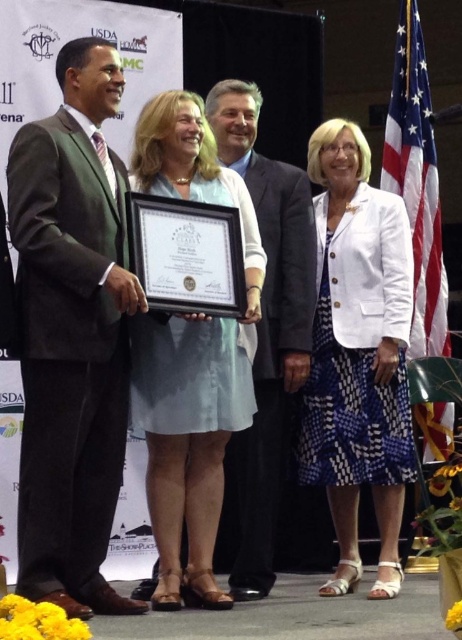
Question: Which point is closer to the camera taking this photo?

Choices:
 (A) pos(247,548)
 (B) pos(53,284)
 (C) pos(348,131)
 (D) pos(405,188)

Answer: (B)

Question: Which object is farther from the camera taking this photo?

Choices:
 (A) white textured blazer at center
 (B) american flag at right
 (C) green suit at left
 (D) light blue fabric dress at center

Answer: (B)

Question: Which point is closer to the camera?

Choices:
 (A) green suit at left
 (B) white textured blazer at center
 (C) american flag at right

Answer: (A)

Question: Is green suit at left further to camera compared to matte black suit at center?

Choices:
 (A) yes
 (B) no

Answer: (B)

Question: Does green suit at left appear on the right side of light blue fabric dress at center?

Choices:
 (A) yes
 (B) no

Answer: (B)

Question: Is light blue fabric dress at center thinner than american flag at right?

Choices:
 (A) no
 (B) yes

Answer: (A)